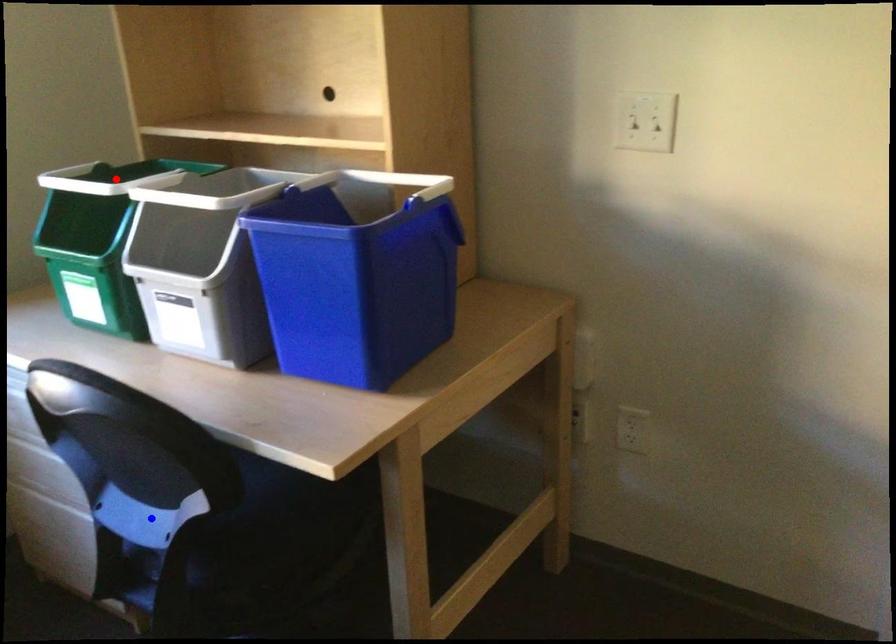
Question: Which of the two points in the image is closer to the camera?

Choices:
 (A) Blue point is closer.
 (B) Red point is closer.

Answer: (A)